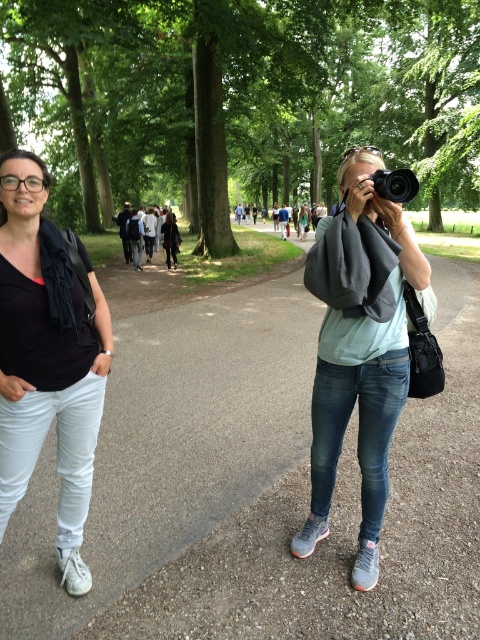
Question: Does smooth asphalt path at center lie behind matte black shirt at left?

Choices:
 (A) no
 (B) yes

Answer: (B)

Question: Which point appears closest to the camera in this image?

Choices:
 (A) (94, 413)
 (B) (99, 589)
 (C) (408, 184)
 (D) (387, 244)

Answer: (C)

Question: Is matte gray camera at center bigger than black plastic camera at center?

Choices:
 (A) no
 (B) yes

Answer: (B)

Question: Estimate the real-world distances between objects in this image. Which object is closer to the black plastic camera at center?

Choices:
 (A) smooth asphalt path at center
 (B) matte gray camera at center

Answer: (B)

Question: Which point is farther to the camera?

Choices:
 (A) black plastic camera at center
 (B) smooth asphalt path at center
 (C) matte black shirt at left
 (D) matte gray camera at center

Answer: (B)

Question: Is smooth asphalt path at center thinner than matte black shirt at left?

Choices:
 (A) no
 (B) yes

Answer: (A)